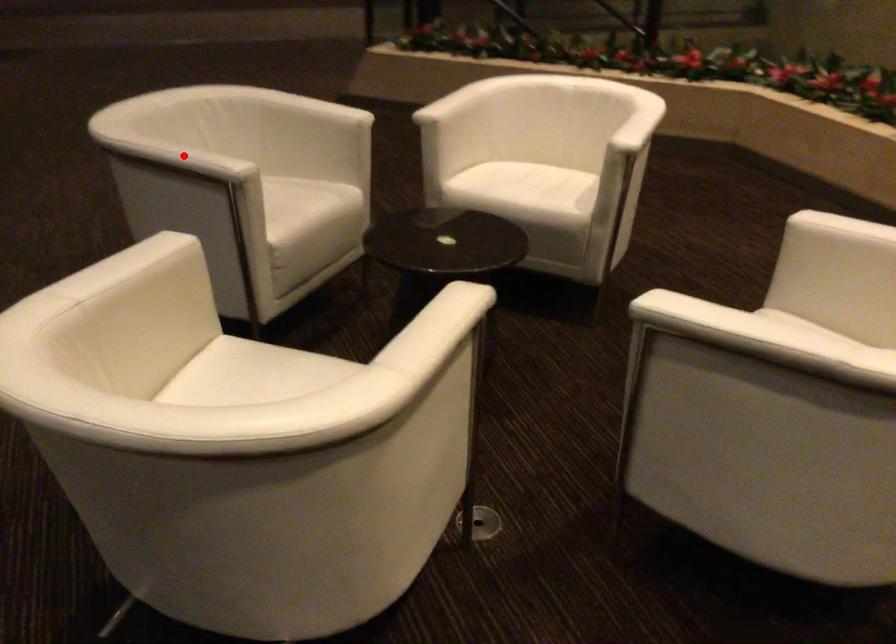
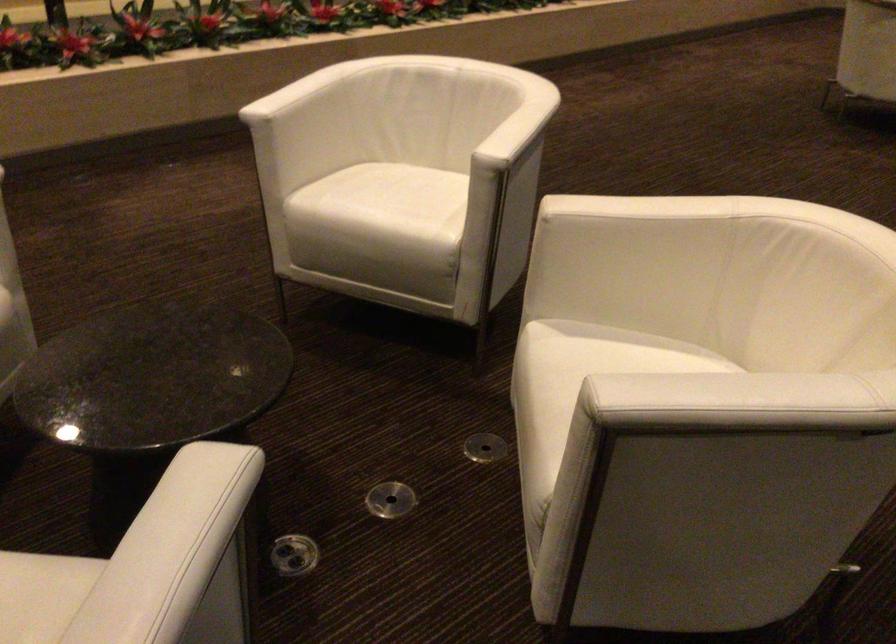
Question: I am providing you with two images of the same scene from different viewpoints. Given a red point in image1, look at the same physical point in image2. Is it:

Choices:
 (A) Closer to the viewpoint
 (B) Farther from the viewpoint

Answer: (A)